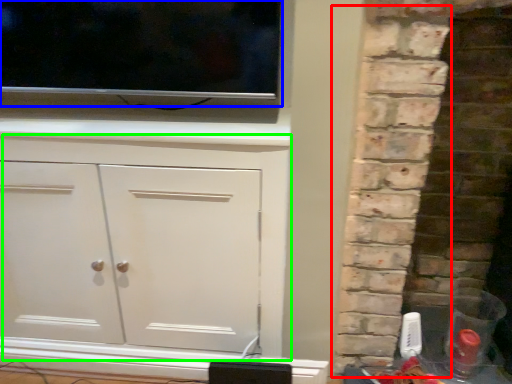
Question: Considering the real-world distances, which object is farthest from brickwork (highlighted by a red box)? tv show (highlighted by a blue box) or cupboard (highlighted by a green box)?

Choices:
 (A) tv show
 (B) cupboard

Answer: (A)